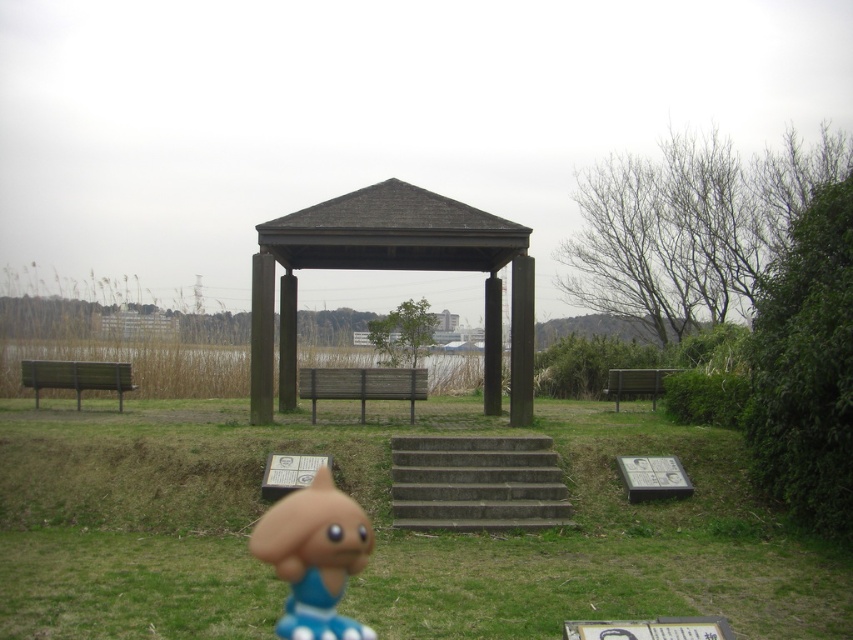
Is point (331, 397) positioned after point (631, 385)?

No, it is not.

Does wooden bench at center appear under wooden bench at right?

Yes.

The width and height of the screenshot is (853, 640). What are the coordinates of `wooden bench at center` in the screenshot? It's located at (363, 385).

Is wooden bench at left behind wooden bench at right?

No, wooden bench at left is in front of wooden bench at right.

Who is more distant from viewer, (65, 365) or (616, 378)?

The point (616, 378) is behind.

Who is more distant from viewer, (99, 378) or (633, 371)?

The point (633, 371) is more distant.

Identify the location of wooden bench at left. The height and width of the screenshot is (640, 853). (76, 376).

Who is higher up, concrete/steps at center or wooden bench at center?

wooden bench at center is higher up.

Does concrete/steps at center have a greater width compared to wooden bench at center?

Indeed, concrete/steps at center has a greater width compared to wooden bench at center.

Image resolution: width=853 pixels, height=640 pixels. In order to click on concrete/steps at center in this screenshot , I will do `click(476, 483)`.